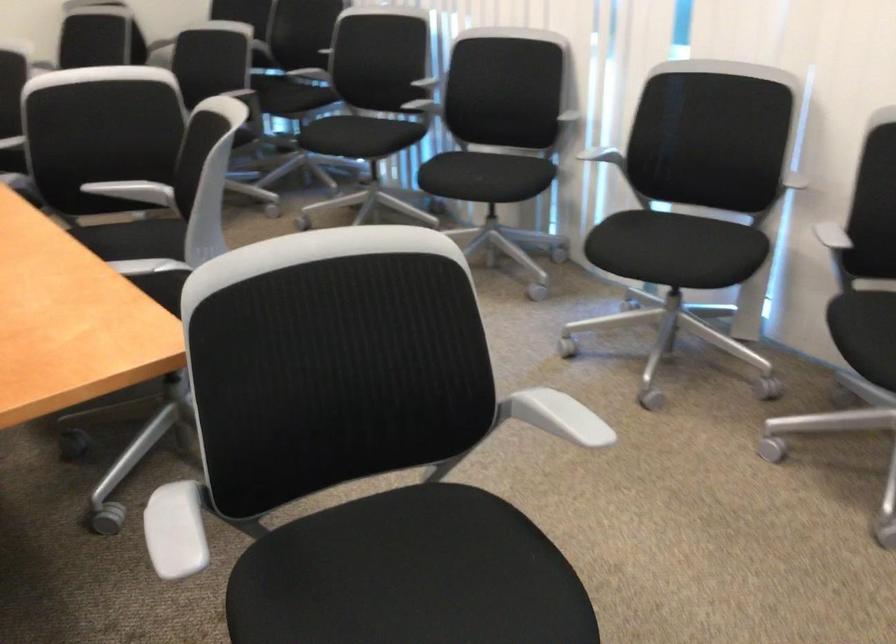
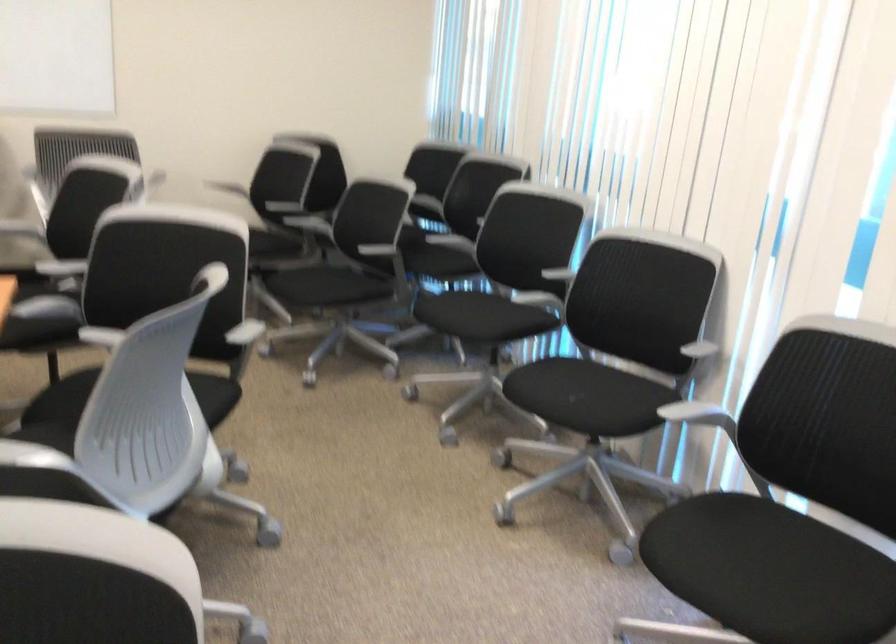
Question: The images are taken continuously from a first-person perspective. In which direction is your viewpoint rotating?

Choices:
 (A) Left
 (B) Right
 (C) Up
 (D) Down

Answer: (A)